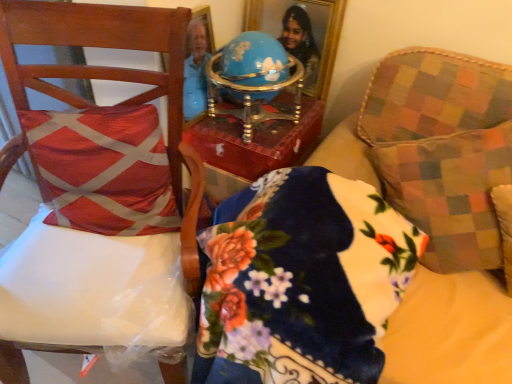
Describe the element at coordinates (302, 281) in the screenshot. This screenshot has width=512, height=384. I see `floral velvet pillow at center` at that location.

What do you see at coordinates (338, 293) in the screenshot? I see `wooden chair at left` at bounding box center [338, 293].

Find the location of a particular element. This screenshot has width=512, height=384. wooden chair at left is located at coordinates (114, 80).

What do you see at coordinates (114, 80) in the screenshot? I see `wooden chair at left` at bounding box center [114, 80].

The width and height of the screenshot is (512, 384). Find the location of `multicolored checkered throw pillow at right, the second throw pillow viewed from the left`. multicolored checkered throw pillow at right, the second throw pillow viewed from the left is located at coordinates (450, 192).

What is the approximate width of gold-framed mirror at upper center?

It is 10.51 centimeters.

This screenshot has width=512, height=384. In order to click on floral velvet pillow at center in this screenshot , I will do `click(302, 281)`.

Starting from the wooden chair at left, which throw pillow is the 1st one behind? Please provide its 2D coordinates.

[(450, 192)]

Is wooden chair at left positioned in front of multicolored checkered throw pillow at right, the second throw pillow viewed from the left?

Yes, the depth of wooden chair at left is less than that of multicolored checkered throw pillow at right, the second throw pillow viewed from the left.

From the image's perspective, is wooden chair at left below multicolored checkered throw pillow at right, the second throw pillow viewed from the left?

Indeed, from the image's perspective, wooden chair at left is shown beneath multicolored checkered throw pillow at right, the second throw pillow viewed from the left.

How distant is floral velvet pillow at center from wooden chair at left?

The distance of floral velvet pillow at center from wooden chair at left is 13.25 inches.

Is wooden chair at left at the back of floral velvet pillow at center?

No.

Which of these two, floral velvet pillow at center or wooden chair at left, stands taller?

wooden chair at left.

Considering the relative positions of floral velvet pillow at center and wooden chair at left in the image provided, is floral velvet pillow at center to the right of wooden chair at left from the viewer's perspective?

Yes.

Who is taller, gold-framed mirror at upper center or wooden chair at left?

With more height is wooden chair at left.

Looking at this image, which object is positioned more to the right, gold-framed mirror at upper center or wooden chair at left?

From the viewer's perspective, gold-framed mirror at upper center appears more on the right side.

Does gold-framed mirror at upper center have a smaller size compared to wooden chair at left?

Correct, gold-framed mirror at upper center occupies less space than wooden chair at left.

From the image's perspective, which is below, gold-framed mirror at upper center or wooden chair at left?

wooden chair at left is shown below in the image.

Is wooden chair at left shorter than wooden chair at left?

No, wooden chair at left is not shorter than wooden chair at left.

Does point (169, 174) come in front of point (457, 276)?

No.

Is wooden chair at left placed right next to wooden chair at left?

No, wooden chair at left is not touching wooden chair at left.

Is wooden chair at left aimed at wooden chair at left?

No.

Does floral velvet pillow at center turn towards multicolored checkered throw pillow at right, which appears as the first throw pillow when viewed from the right?

No, floral velvet pillow at center is not turned towards multicolored checkered throw pillow at right, which appears as the first throw pillow when viewed from the right.

In the scene shown: Can you confirm if floral velvet pillow at center is bigger than multicolored checkered throw pillow at right, which appears as the first throw pillow when viewed from the right?

Correct, floral velvet pillow at center is larger in size than multicolored checkered throw pillow at right, which appears as the first throw pillow when viewed from the right.

From the image's perspective, is floral velvet pillow at center under multicolored checkered throw pillow at right, which appears as the first throw pillow when viewed from the right?

Yes, from the image's perspective, floral velvet pillow at center is beneath multicolored checkered throw pillow at right, which appears as the first throw pillow when viewed from the right.

Is wooden chair at left bigger than wooden chair at left?

Yes, wooden chair at left is bigger than wooden chair at left.

Image resolution: width=512 pixels, height=384 pixels. I want to click on chair above the wooden chair at left (from the image's perspective), so click(x=114, y=80).

Would you say wooden chair at left is part of wooden chair at left's contents?

No, wooden chair at left is located outside of wooden chair at left.

From a real-world perspective, is wooden chair at left physically above wooden chair at left?

No, from a real-world perspective, wooden chair at left is not above wooden chair at left.

Looking at their sizes, would you say gold-framed mirror at upper center is wider or thinner than multicolored checkered throw pillow at right, the second throw pillow viewed from the left?

Clearly, gold-framed mirror at upper center has less width compared to multicolored checkered throw pillow at right, the second throw pillow viewed from the left.

Would you say gold-framed mirror at upper center is outside multicolored checkered throw pillow at right, the second throw pillow viewed from the left?

That's correct, gold-framed mirror at upper center is outside of multicolored checkered throw pillow at right, the second throw pillow viewed from the left.

Is gold-framed mirror at upper center oriented away from multicolored checkered throw pillow at right, which appears as the first throw pillow when viewed from the right?

No, gold-framed mirror at upper center's orientation is not away from multicolored checkered throw pillow at right, which appears as the first throw pillow when viewed from the right.

From the image's perspective, is gold-framed mirror at upper center located above or below multicolored checkered throw pillow at right, the second throw pillow viewed from the left?

Clearly, from the image's perspective, gold-framed mirror at upper center is above multicolored checkered throw pillow at right, the second throw pillow viewed from the left.

Where is `chair that appears below the multicolored checkered throw pillow at right, the second throw pillow viewed from the left (from a real-world perspective)`? chair that appears below the multicolored checkered throw pillow at right, the second throw pillow viewed from the left (from a real-world perspective) is located at coordinates (114, 80).

I want to click on chair on the left of floral velvet pillow at center, so click(114, 80).

When comparing their distances from wooden chair at left, does wooden chair at left or red textured cushion at left, which is counted as the second throw pillow, starting from the right, seem further?

red textured cushion at left, which is counted as the second throw pillow, starting from the right, lies further to wooden chair at left than the other object.

From the picture: When comparing their distances from red textured cushion at left, the first throw pillow positioned from the left, does wooden chair at left or wooden chair at left seem closer?

Based on the image, wooden chair at left appears to be nearer to red textured cushion at left, the first throw pillow positioned from the left.

Which object lies further to the anchor point wooden chair at left, red textured cushion at left, the first throw pillow positioned from the left, or wooden chair at left?

red textured cushion at left, the first throw pillow positioned from the left, is further to wooden chair at left.

From the picture: Considering their positions, is wooden chair at left positioned closer to wooden chair at left than floral velvet pillow at center?

floral velvet pillow at center is closer to wooden chair at left.

Based on their spatial positions, is wooden chair at left or floral velvet pillow at center closer to gold-framed mirror at upper center?

wooden chair at left is positioned closer to the anchor gold-framed mirror at upper center.

From the image, which object appears to be farther from wooden chair at left, gold-framed mirror at upper center or wooden chair at left?

The object further to wooden chair at left is gold-framed mirror at upper center.

Looking at the image, which one is located closer to floral velvet pillow at center, wooden chair at left or wooden chair at left?

wooden chair at left lies closer to floral velvet pillow at center than the other object.

Which object lies further to the anchor point floral velvet pillow at center, wooden chair at left or red textured cushion at left, which is counted as the second throw pillow, starting from the right?

red textured cushion at left, which is counted as the second throw pillow, starting from the right.

Locate an element on the screen. This screenshot has height=384, width=512. chair between gold-framed mirror at upper center and floral velvet pillow at center in the up-down direction is located at coordinates (114, 80).

Find the location of a particular element. The image size is (512, 384). pillow between red textured cushion at left, which is counted as the second throw pillow, starting from the right, and wooden chair at left, in the horizontal direction is located at coordinates (302, 281).

Locate an element on the screen. Image resolution: width=512 pixels, height=384 pixels. furniture between red textured cushion at left, the first throw pillow positioned from the left, and multicolored checkered throw pillow at right, the second throw pillow viewed from the left, in the horizontal direction is located at coordinates (338, 293).

Where is `pillow between wooden chair at left and multicolored checkered throw pillow at right, the second throw pillow viewed from the left, along the z-axis`? The image size is (512, 384). pillow between wooden chair at left and multicolored checkered throw pillow at right, the second throw pillow viewed from the left, along the z-axis is located at coordinates (302, 281).